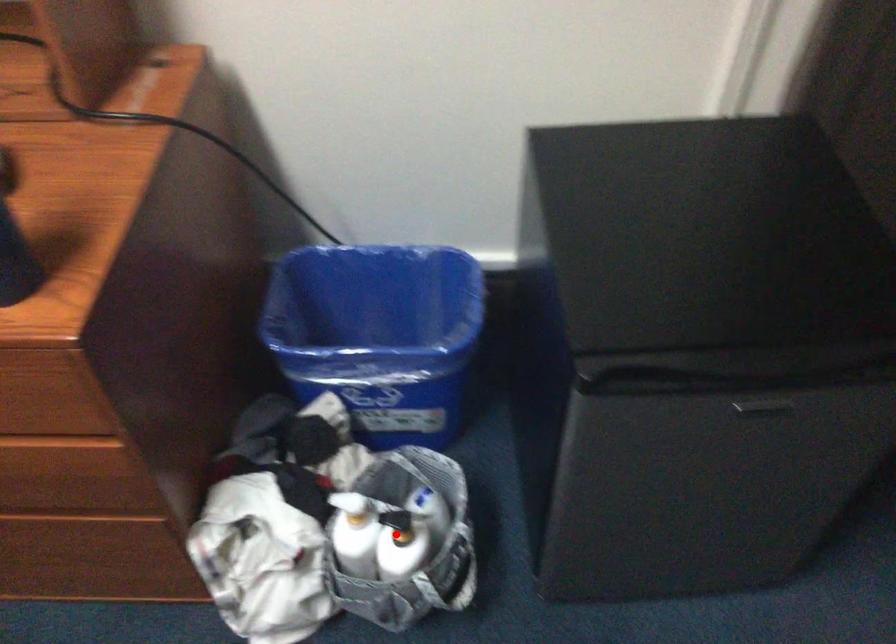
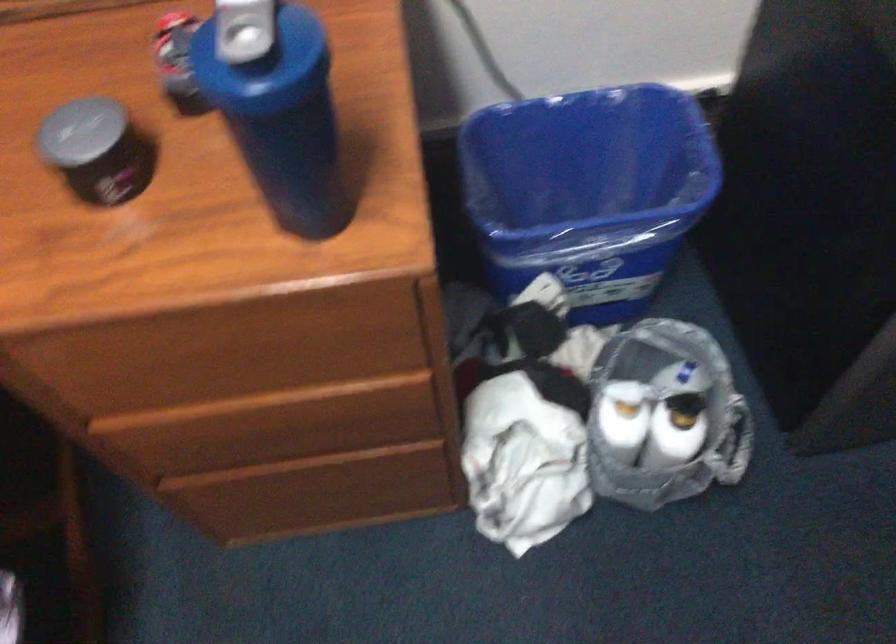
Find the pixel in the second image that matches the highlighted location in the first image.

(676, 417)